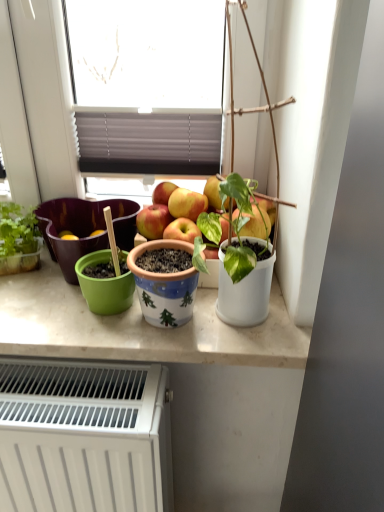
Question: In which direction should I rotate to look at blue ceramic pot at center, which is the second flowerpot in left-to-right order?

Choices:
 (A) left
 (B) right

Answer: (A)

Question: From the image's perspective, is white matte radiator at lower left below white matte pot at right?

Choices:
 (A) no
 (B) yes

Answer: (B)

Question: Is white matte pot at right completely or partially inside white matte radiator at lower left?

Choices:
 (A) yes
 (B) no

Answer: (B)

Question: Can you confirm if white matte radiator at lower left is positioned to the left of white matte pot at right?

Choices:
 (A) no
 (B) yes

Answer: (B)

Question: Considering the relative sizes of white matte radiator at lower left and white matte pot at right in the image provided, is white matte radiator at lower left bigger than white matte pot at right?

Choices:
 (A) yes
 (B) no

Answer: (A)

Question: Would you say white matte radiator at lower left is outside white matte pot at right?

Choices:
 (A) no
 (B) yes

Answer: (B)

Question: From a real-world perspective, is white matte radiator at lower left positioned over white matte pot at right based on gravity?

Choices:
 (A) no
 (B) yes

Answer: (A)

Question: Would you say white matte pot at right contains green matte flowerpot at left, acting as the 2th flowerpot starting from the right?

Choices:
 (A) no
 (B) yes

Answer: (A)

Question: Are white matte pot at right and green matte flowerpot at left, the 2th flowerpot positioned from the front, located far from each other?

Choices:
 (A) no
 (B) yes

Answer: (A)

Question: Can you confirm if white matte pot at right is thinner than green matte flowerpot at left, the 1th flowerpot when ordered from left to right?

Choices:
 (A) yes
 (B) no

Answer: (A)

Question: Considering the relative sizes of white matte pot at right and green matte flowerpot at left, the 1th flowerpot when ordered from left to right, in the image provided, is white matte pot at right shorter than green matte flowerpot at left, the 1th flowerpot when ordered from left to right,?

Choices:
 (A) no
 (B) yes

Answer: (A)

Question: Is the position of white matte pot at right less distant than that of green matte flowerpot at left, which appears as the first flowerpot when viewed from the back?

Choices:
 (A) no
 (B) yes

Answer: (B)

Question: From a real-world perspective, is white matte pot at right physically above green matte flowerpot at left, acting as the 2th flowerpot starting from the right?

Choices:
 (A) no
 (B) yes

Answer: (B)

Question: Is the position of blue ceramic pot at center, the 2th flowerpot when ordered from back to front, less distant than that of white matte pot at right?

Choices:
 (A) yes
 (B) no

Answer: (B)